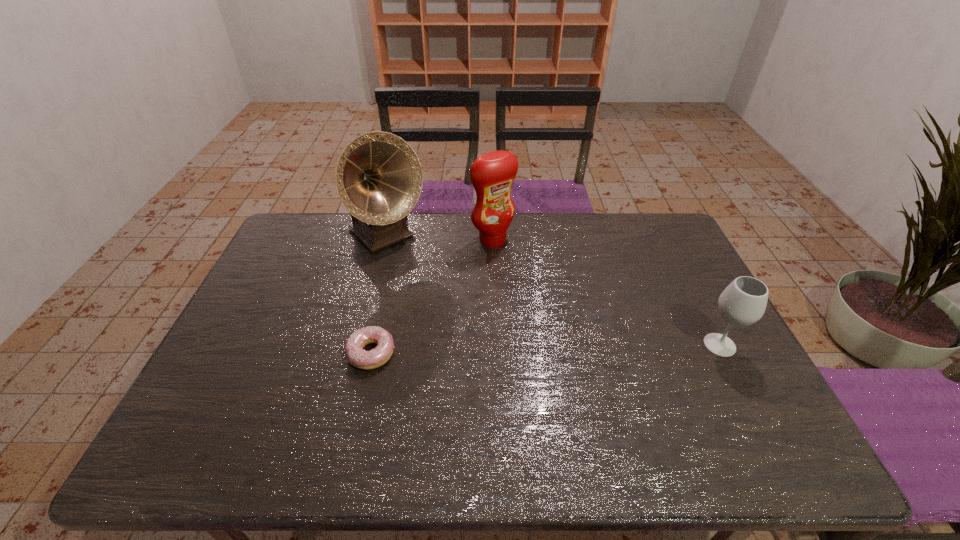
What are the coordinates of `free space located 0.270m on the label side of the second tallest object` in the screenshot? It's located at (552, 298).

Where is `vacant space situated 0.140m on the horn of the tallest object`? This screenshot has height=540, width=960. vacant space situated 0.140m on the horn of the tallest object is located at coordinates tap(430, 278).

The width and height of the screenshot is (960, 540). I want to click on free space located on the horn of the tallest object, so click(432, 280).

Find the location of a particular element. The image size is (960, 540). vacant area located on the horn of the tallest object is located at coordinates (478, 325).

This screenshot has width=960, height=540. What are the coordinates of `condiment positioned at the far edge` in the screenshot? It's located at (492, 174).

You are a GUI agent. You are given a task and a screenshot of the screen. Output one action in this format:
    pyautogui.click(x=<x>, y=<y>)
    Task: Click on the phonograph record present at the far edge
    This screenshot has height=540, width=960.
    Given the screenshot: What is the action you would take?
    pyautogui.click(x=379, y=178)

Locate an element on the screen. This screenshot has height=540, width=960. object located at the right edge is located at coordinates (743, 302).

This screenshot has width=960, height=540. I want to click on vacant space at the far edge of the desktop, so click(x=502, y=253).

This screenshot has width=960, height=540. I want to click on free space at the near edge, so click(552, 403).

In order to click on free region at the left edge in this screenshot , I will do `click(302, 292)`.